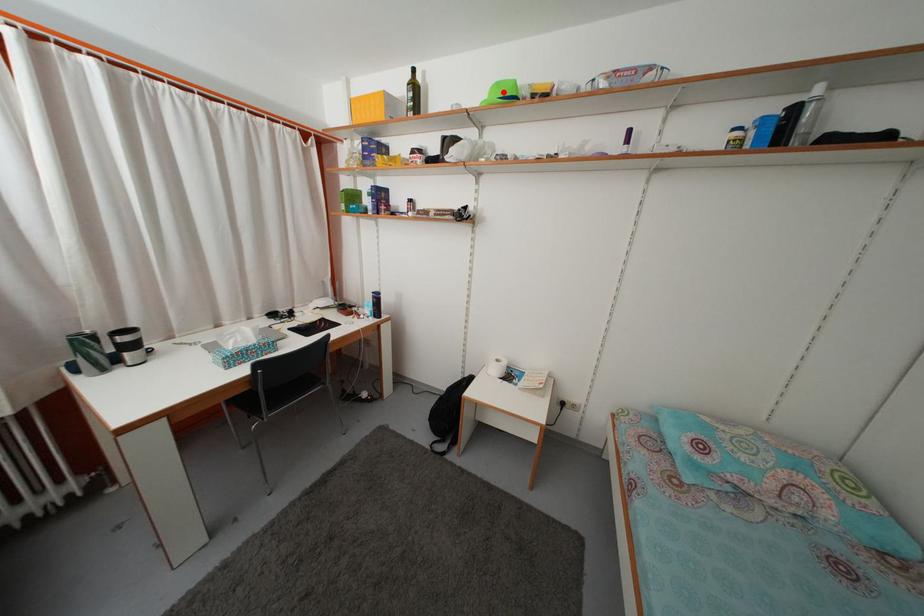
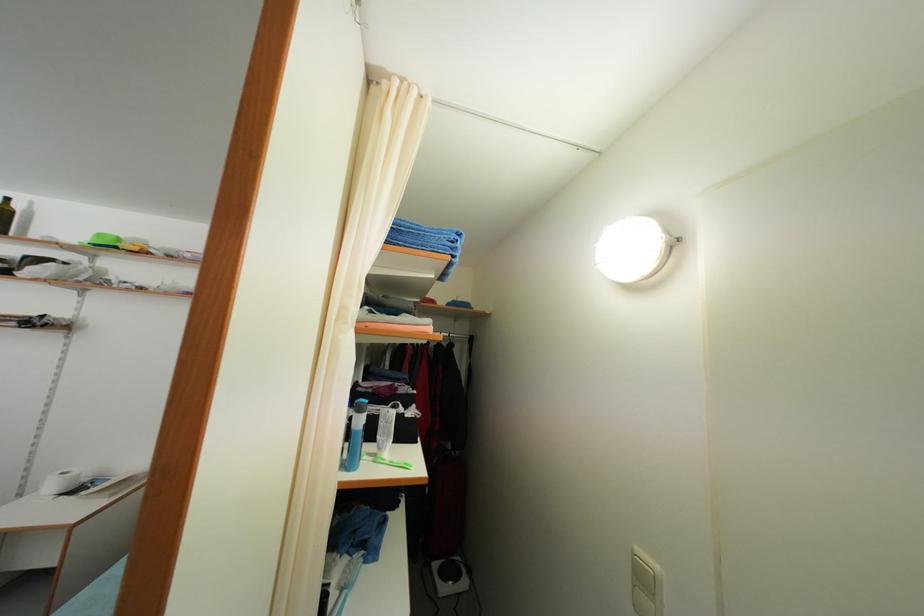
Question: I am providing you with two images of the same scene from different viewpoints. A red point is marked on the first image. Is the red point's position out of view in image 2?

Choices:
 (A) Yes
 (B) No

Answer: (B)